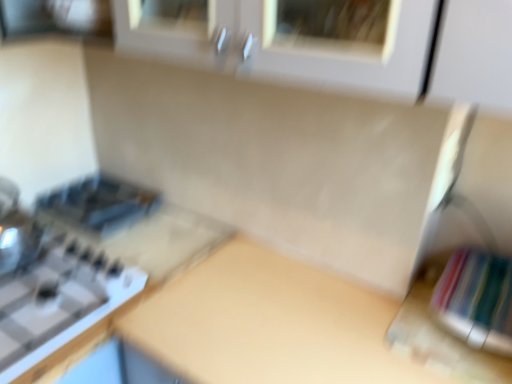
Question: Is satin black toaster at left looking in the opposite direction of white glossy gas stove at left?

Choices:
 (A) yes
 (B) no

Answer: (B)

Question: Is satin black toaster at left taller than white glossy gas stove at left?

Choices:
 (A) no
 (B) yes

Answer: (B)

Question: Is white glossy gas stove at left completely or partially inside satin black toaster at left?

Choices:
 (A) no
 (B) yes

Answer: (A)

Question: Is satin black toaster at left positioned far away from white glossy gas stove at left?

Choices:
 (A) no
 (B) yes

Answer: (A)

Question: Is satin black toaster at left not within white glossy gas stove at left?

Choices:
 (A) yes
 (B) no

Answer: (A)

Question: Is the position of satin black toaster at left less distant than that of white glossy gas stove at left?

Choices:
 (A) no
 (B) yes

Answer: (A)

Question: Does white glossy gas stove at left have a smaller size compared to satin black toaster at left?

Choices:
 (A) yes
 (B) no

Answer: (B)

Question: Is white glossy gas stove at left positioned with its back to satin black toaster at left?

Choices:
 (A) yes
 (B) no

Answer: (B)

Question: Considering the relative positions of white glossy gas stove at left and satin black toaster at left in the image provided, is white glossy gas stove at left to the right of satin black toaster at left from the viewer's perspective?

Choices:
 (A) yes
 (B) no

Answer: (B)

Question: Is satin black toaster at left located within white glossy gas stove at left?

Choices:
 (A) no
 (B) yes

Answer: (A)

Question: Is white glossy gas stove at left positioned behind satin black toaster at left?

Choices:
 (A) yes
 (B) no

Answer: (B)

Question: Is white glossy gas stove at left bigger than satin black toaster at left?

Choices:
 (A) yes
 (B) no

Answer: (A)

Question: Does beige matte counter top at center touch satin black toaster at left?

Choices:
 (A) no
 (B) yes

Answer: (A)